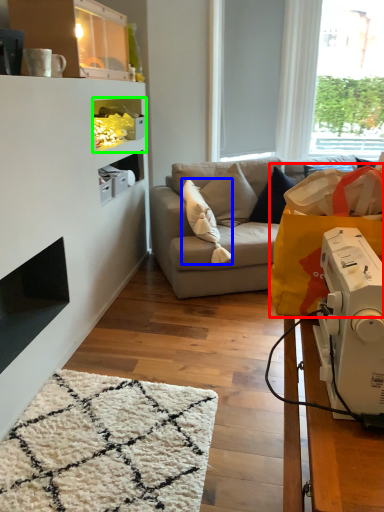
Question: Based on their relative distances, which object is nearer to grocery bag (highlighted by a red box)? Choose from pillow (highlighted by a blue box) and shelf (highlighted by a green box).

Choices:
 (A) pillow
 (B) shelf

Answer: (A)